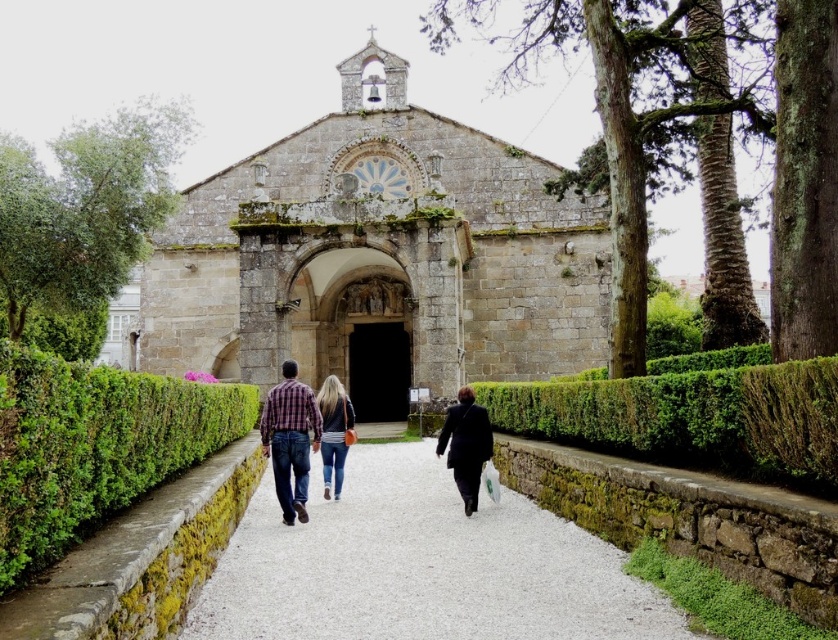
Question: Is green leafy hedge at center wider than denim jeans at center?

Choices:
 (A) no
 (B) yes

Answer: (A)

Question: Is smooth gravel path at center smaller than plaid fabric shirt at center?

Choices:
 (A) no
 (B) yes

Answer: (A)

Question: Does plaid fabric shirt at center have a greater width compared to dark blue fabric coat at center?

Choices:
 (A) yes
 (B) no

Answer: (A)

Question: Based on their relative distances, which object is farther from the green leafy hedge at center?

Choices:
 (A) smooth gravel path at center
 (B) dark blue fabric coat at center
 (C) denim jeans at center

Answer: (B)

Question: Which point appears closest to the camera in this image?

Choices:
 (A) (544, 228)
 (B) (324, 380)
 (C) (218, 628)
 (D) (74, 524)

Answer: (D)

Question: Which object is the closest to the smooth gravel path at center?

Choices:
 (A) green leafy hedge at center
 (B) stone church at center
 (C) dark blue fabric coat at center

Answer: (C)